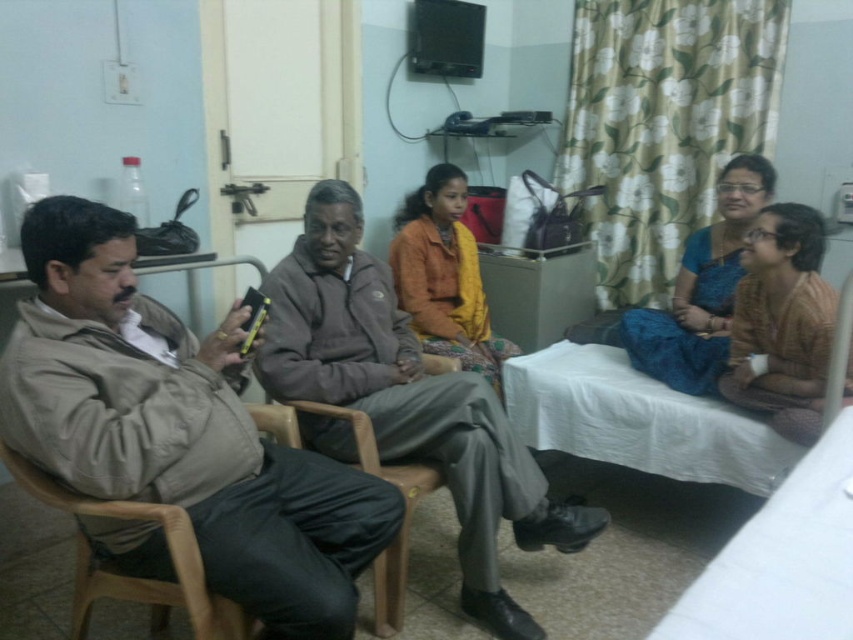
You are a nurse entering the hospital room and need to place a medical chart on the nearest surface to the blue silk saree at center. Which object should you choose?

The blue silk saree at center is located at point [701,289]. The nearest surface would depend on the specific layout of the room, but since the saree is at the center, the shelf below the television might be the closest available surface for placing the medical chart.

You are a nurse entering the hospital room and need to locate the orange fabric jacket at center and the brown wood chair at left. Which object is positioned higher from the floor?

The orange fabric jacket at center is positioned higher from the floor than the brown wood chair at left because it is stated to be above it.